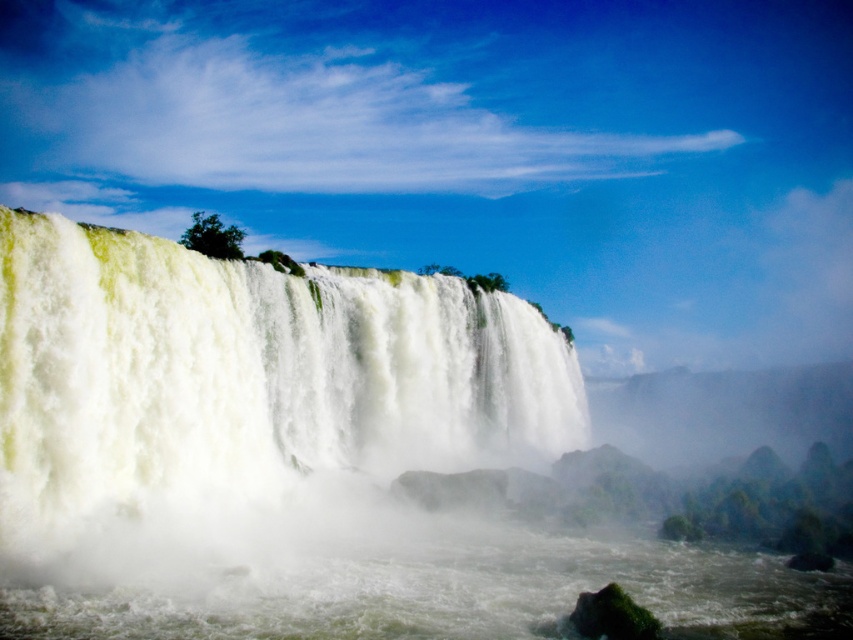
Question: Is white foamy water at center above white frothy water at lower center?

Choices:
 (A) no
 (B) yes

Answer: (B)

Question: Which point is closer to the camera?

Choices:
 (A) white foamy water at center
 (B) white frothy water at lower center

Answer: (B)

Question: Can you confirm if white foamy water at center is positioned below white frothy water at lower center?

Choices:
 (A) yes
 (B) no

Answer: (B)

Question: Can you confirm if white foamy water at center is positioned above white frothy water at lower center?

Choices:
 (A) no
 (B) yes

Answer: (B)

Question: Among these points, which one is farthest from the camera?

Choices:
 (A) (131, 456)
 (B) (357, 611)

Answer: (A)